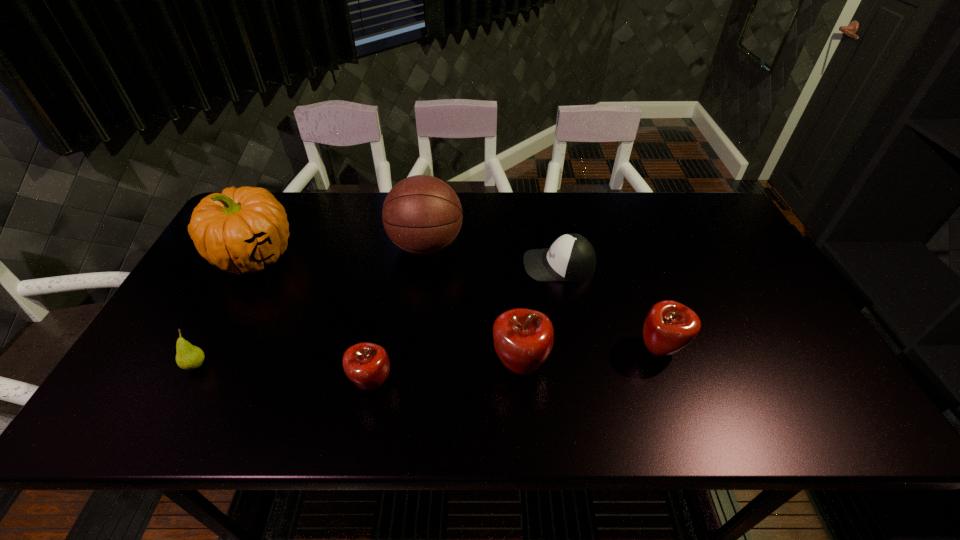
At what (x,y) coordinates should I click in order to perform the action: click on pumpkin located in the left edge section of the desktop. Please return your answer as a coordinate pair (x, y). The width and height of the screenshot is (960, 540). Looking at the image, I should click on (240, 231).

The image size is (960, 540). I want to click on pear situated at the left edge, so click(188, 357).

Identify the location of object located in the far left corner section of the desktop. (240, 231).

The image size is (960, 540). I want to click on object situated at the near left corner, so click(188, 357).

Where is `vacant space at the far edge of the desktop`? vacant space at the far edge of the desktop is located at coordinates (341, 215).

In the image, there is a desktop. At what (x,y) coordinates should I click in order to perform the action: click on free space at the near edge. Please return your answer as a coordinate pair (x, y). The width and height of the screenshot is (960, 540). Looking at the image, I should click on (461, 360).

Identify the location of free space at the left edge of the desktop. The width and height of the screenshot is (960, 540). click(x=223, y=300).

Locate an element on the screen. The width and height of the screenshot is (960, 540). vacant space at the far right corner is located at coordinates (691, 202).

Locate an element on the screen. vacant point located between the pear and the shortest apple is located at coordinates (284, 375).

I want to click on vacant area that lies between the pear and the fourth tallest object, so click(x=428, y=357).